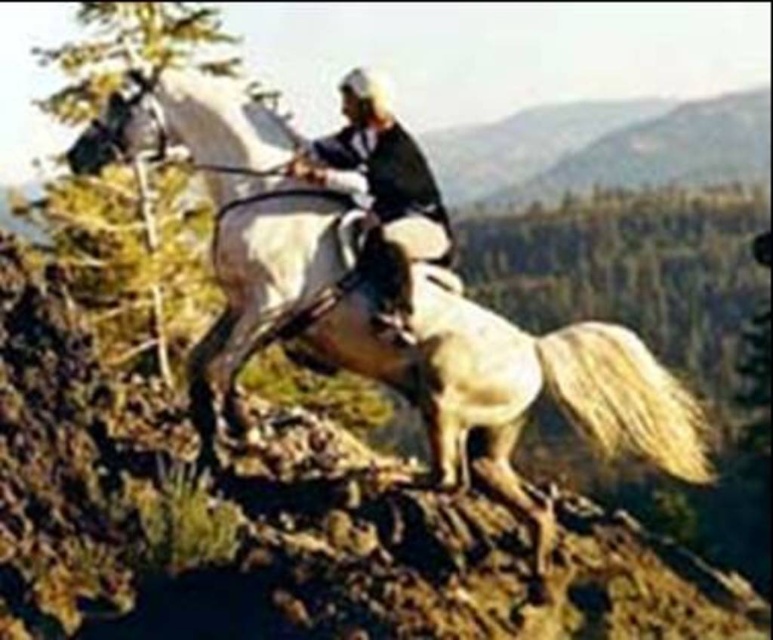
Question: Is white glossy horse at center thinner than smooth leather jacket at center?

Choices:
 (A) yes
 (B) no

Answer: (B)

Question: Can you confirm if white glossy horse at center is smaller than smooth leather jacket at center?

Choices:
 (A) no
 (B) yes

Answer: (A)

Question: Which point is closer to the camera taking this photo?

Choices:
 (A) (240, 296)
 (B) (386, 196)

Answer: (B)

Question: Considering the relative positions of white glossy horse at center and smooth leather jacket at center in the image provided, where is white glossy horse at center located with respect to smooth leather jacket at center?

Choices:
 (A) left
 (B) right

Answer: (B)